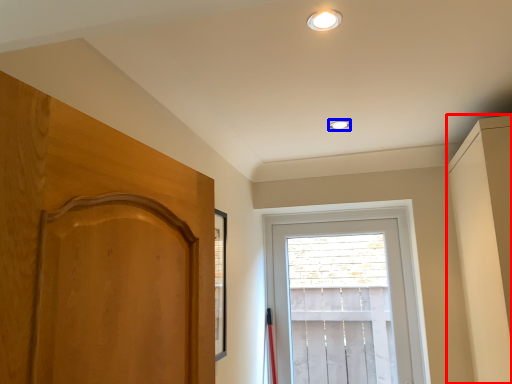
Question: Which of the following is the closest to the observer, dresser (highlighted by a red box) or lighting (highlighted by a blue box)?

Choices:
 (A) dresser
 (B) lighting

Answer: (A)